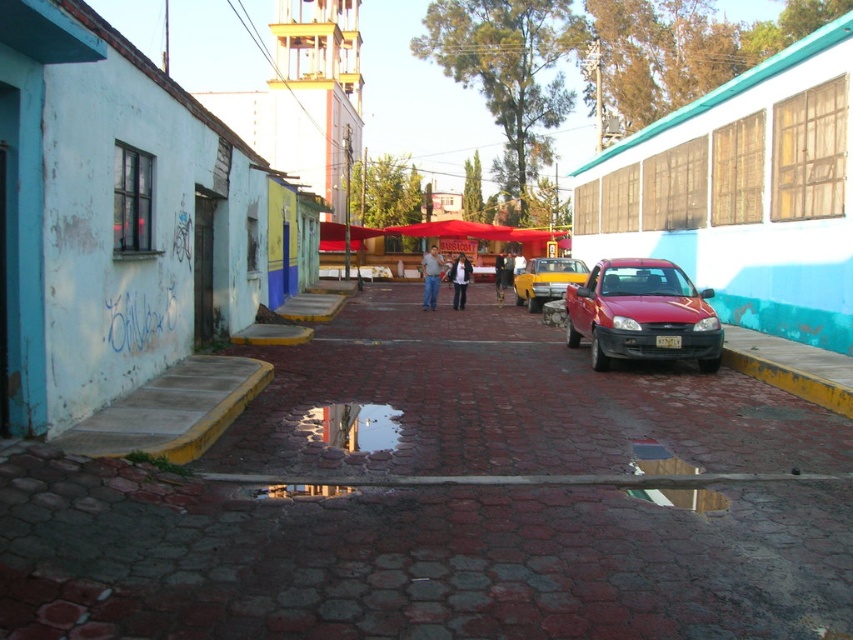
Does yellow metallic car at center lie in front of dark blue jeans at center?

Yes, it is.

Can you confirm if yellow metallic car at center is shorter than dark blue jeans at center?

Correct, yellow metallic car at center is not as tall as dark blue jeans at center.

You are a GUI agent. You are given a task and a screenshot of the screen. Output one action in this format:
    pyautogui.click(x=<x>, y=<y>)
    Task: Click on the yellow metallic car at center
    
    Given the screenshot: What is the action you would take?
    pyautogui.click(x=546, y=280)

You are a GUI agent. You are given a task and a screenshot of the screen. Output one action in this format:
    pyautogui.click(x=<x>, y=<y>)
    Task: Click on the yellow metallic car at center
    
    Given the screenshot: What is the action you would take?
    pyautogui.click(x=546, y=280)

Does brick at center appear under denim jacket at center?

Indeed, brick at center is positioned under denim jacket at center.

Is brick at center thinner than denim jacket at center?

Incorrect, brick at center's width is not less than denim jacket at center's.

Identify the location of brick at center. (408, 560).

Does glossy red car at center appear over denim jeans at center?

No.

Image resolution: width=853 pixels, height=640 pixels. Identify the location of glossy red car at center. click(x=642, y=314).